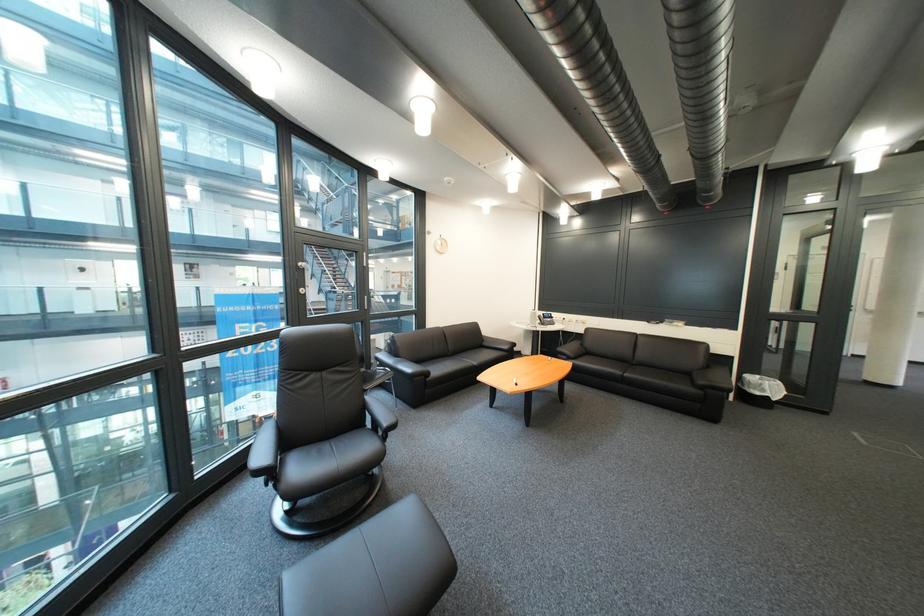
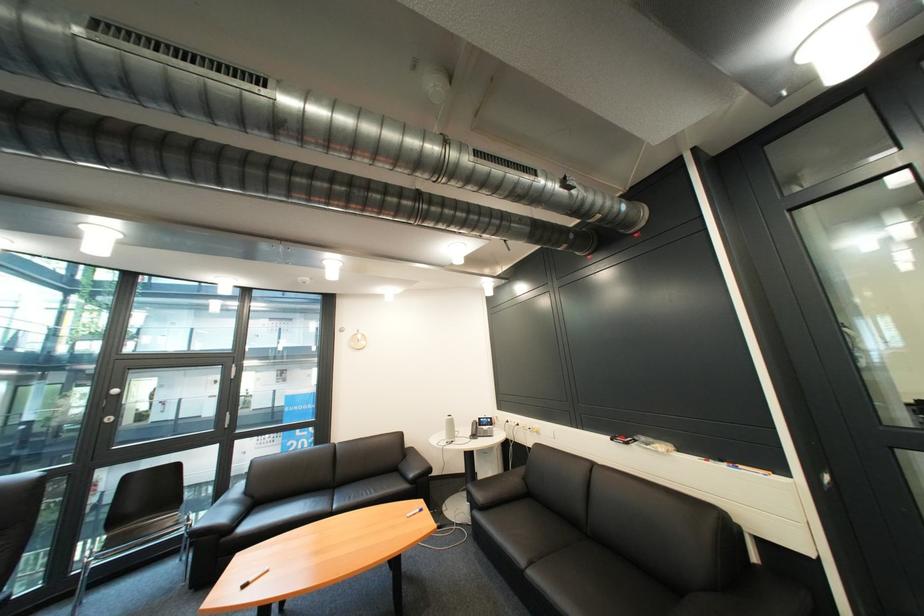
Where in the second image is the point corresponding to (556,315) from the first image?

(492, 419)